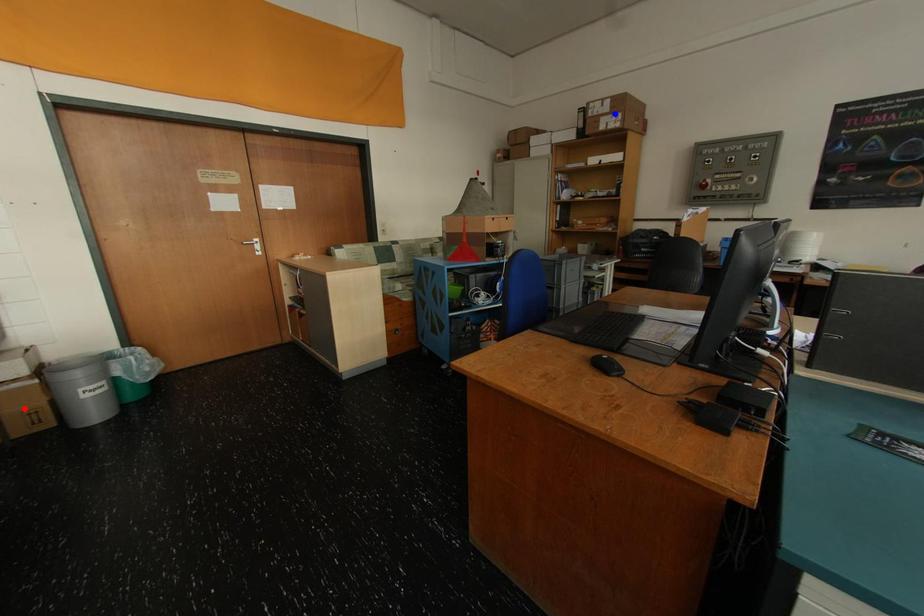
Question: In the image, two points are highlighted. Which point is nearer to the camera? Reply with the corresponding letter.

Choices:
 (A) blue point
 (B) red point

Answer: (B)